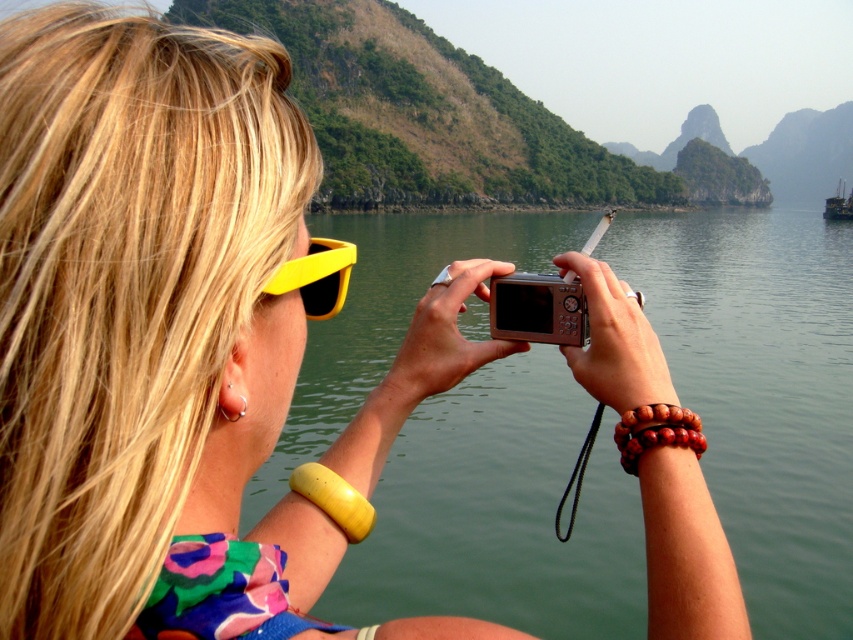
You are a photographer trying to position your equipment. The silver metallic camera at center is currently at point 0.484, 0.631. If you want to move it to the exact center of the image, which is at point 0.5, 0.5, should you move it to the left or right and up or down?

The silver metallic camera at center is at point (x=537, y=308). To move it to the exact center at (x=426, y=320), you should move it slightly to the right and up.